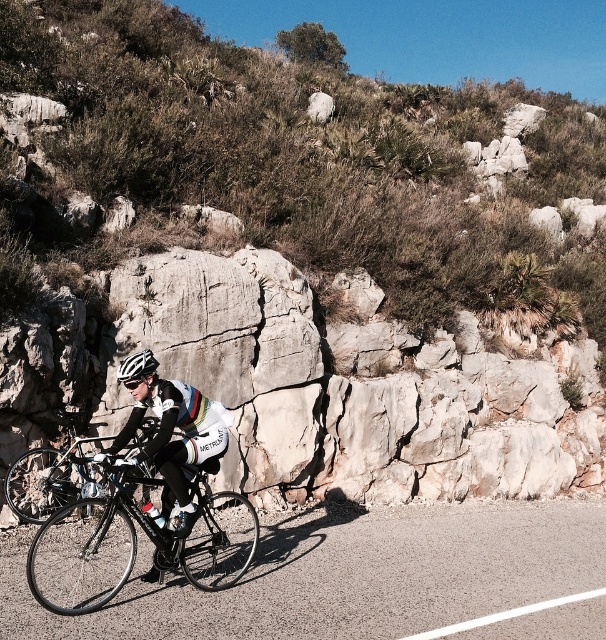
Measure the distance between point (218, 609) and camera.

A distance of 8.92 meters exists between point (218, 609) and camera.

Who is more forward, (602, 509) or (195, 406)?

Point (195, 406)

Where is `black asphalt road at center`? black asphalt road at center is located at coordinates (347, 573).

Is point (247, 598) farther from viewer compared to point (132, 364)?

Yes.

Is black asphalt road at center thinner than white matte bicycle helmet at center?

In fact, black asphalt road at center might be wider than white matte bicycle helmet at center.

Describe the element at coordinates (347, 573) in the screenshot. I see `black asphalt road at center` at that location.

The width and height of the screenshot is (606, 640). Identify the location of black asphalt road at center. (347, 573).

Is shiny black bicycle at center above white matte bicycle helmet at center?

No, shiny black bicycle at center is not above white matte bicycle helmet at center.

Can you confirm if shiny black bicycle at center is positioned to the left of white matte bicycle helmet at center?

Indeed, shiny black bicycle at center is positioned on the left side of white matte bicycle helmet at center.

This screenshot has height=640, width=606. What do you see at coordinates (135, 541) in the screenshot?
I see `shiny black bicycle at center` at bounding box center [135, 541].

I want to click on shiny black bicycle at center, so click(135, 541).